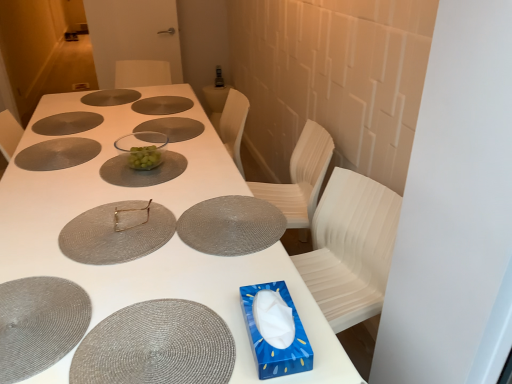
Locate an element on the screen. free area in between matte gray glass plate at upper left, which is counted as the 7th glass plate, starting from the front, and matte silver fork at center is located at coordinates (83, 153).